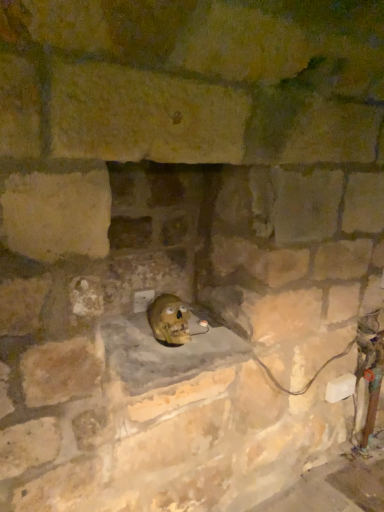
Where is `free space to the right of yellow matte skull at center`? Image resolution: width=384 pixels, height=512 pixels. free space to the right of yellow matte skull at center is located at coordinates (217, 339).